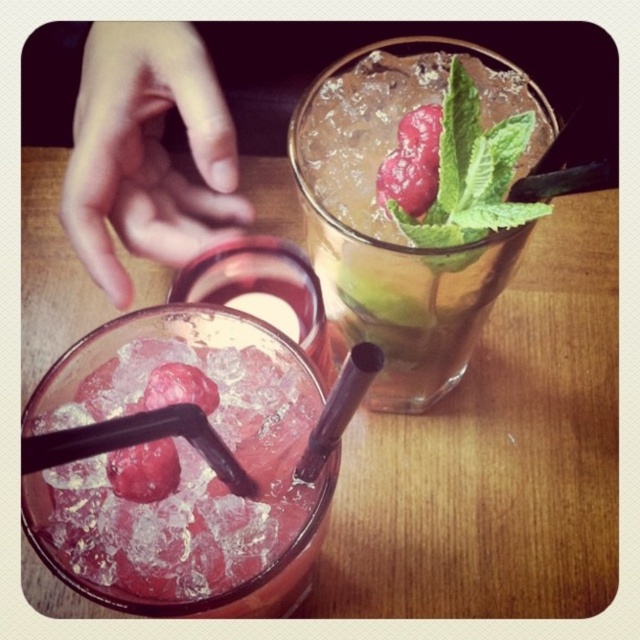
You are arranging a small party and need to place a decorative centerpiece on the table. Given that the wooden table at center is to the left of the glossy red raspberry at center, where should you place the centerpiece to ensure it is centered between both objects?

The wooden table at center is positioned on the left side of the glossy red raspberry at center, so placing the centerpiece between them would require centering it between the two objects, ensuring it is equidistant from both the wooden table at center and the glossy red raspberry at center.

You are a bartender arranging drinks on a table. You have a translucent glass at center and a clear glass at upper right. According to the scene, where should you place a garnish so it won

The translucent glass at center is located below the clear glass at upper right. Therefore, placing the garnish on the translucent glass at center would ensure it is positioned lower than the clear glass at upper right, creating a visually balanced arrangement.

Looking at this image, you have two glasses on the table. The translucent glass at center and the clear glass at upper right. Which one has a larger opening to drink from?

The translucent glass at center has a larger opening than the clear glass at upper right.